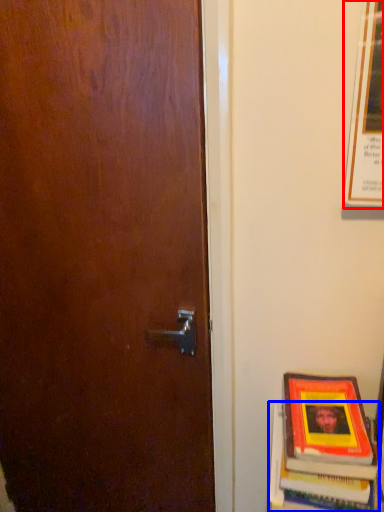
Question: Which of the following is the closest to the observer, poster (highlighted by a red box) or book (highlighted by a blue box)?

Choices:
 (A) poster
 (B) book

Answer: (A)